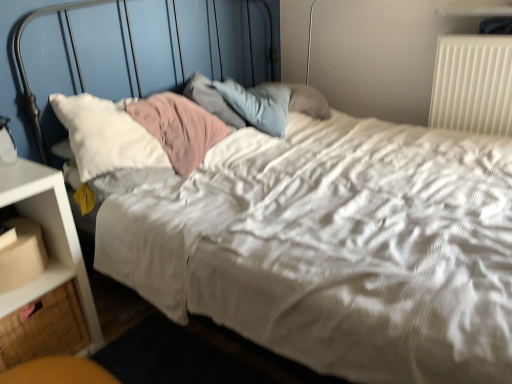
Question: Is white plastic nightstand at lower left shorter than beige fabric drawer at lower left?

Choices:
 (A) yes
 (B) no

Answer: (B)

Question: Is white plastic nightstand at lower left looking in the opposite direction of beige fabric drawer at lower left?

Choices:
 (A) no
 (B) yes

Answer: (B)

Question: Is white plastic nightstand at lower left to the left of beige fabric drawer at lower left from the viewer's perspective?

Choices:
 (A) yes
 (B) no

Answer: (B)

Question: From the image's perspective, is white plastic nightstand at lower left on top of beige fabric drawer at lower left?

Choices:
 (A) yes
 (B) no

Answer: (A)

Question: Considering the relative sizes of white plastic nightstand at lower left and beige fabric drawer at lower left in the image provided, is white plastic nightstand at lower left thinner than beige fabric drawer at lower left?

Choices:
 (A) no
 (B) yes

Answer: (A)

Question: Is beige fabric drawer at lower left located within white plastic nightstand at lower left?

Choices:
 (A) no
 (B) yes

Answer: (B)

Question: Can you confirm if matte cardboard box at lower left is bigger than white plastic radiator at upper right?

Choices:
 (A) no
 (B) yes

Answer: (A)

Question: From a real-world perspective, is matte cardboard box at lower left on white plastic radiator at upper right?

Choices:
 (A) yes
 (B) no

Answer: (B)

Question: From the image's perspective, is matte cardboard box at lower left on white plastic radiator at upper right?

Choices:
 (A) no
 (B) yes

Answer: (A)

Question: Is matte cardboard box at lower left wider than white plastic radiator at upper right?

Choices:
 (A) yes
 (B) no

Answer: (A)

Question: Is matte cardboard box at lower left facing towards white plastic radiator at upper right?

Choices:
 (A) yes
 (B) no

Answer: (B)

Question: Is matte cardboard box at lower left closer to the viewer compared to white plastic radiator at upper right?

Choices:
 (A) yes
 (B) no

Answer: (A)

Question: Can you confirm if beige fabric drawer at lower left is positioned to the left of white plastic radiator at upper right?

Choices:
 (A) yes
 (B) no

Answer: (A)